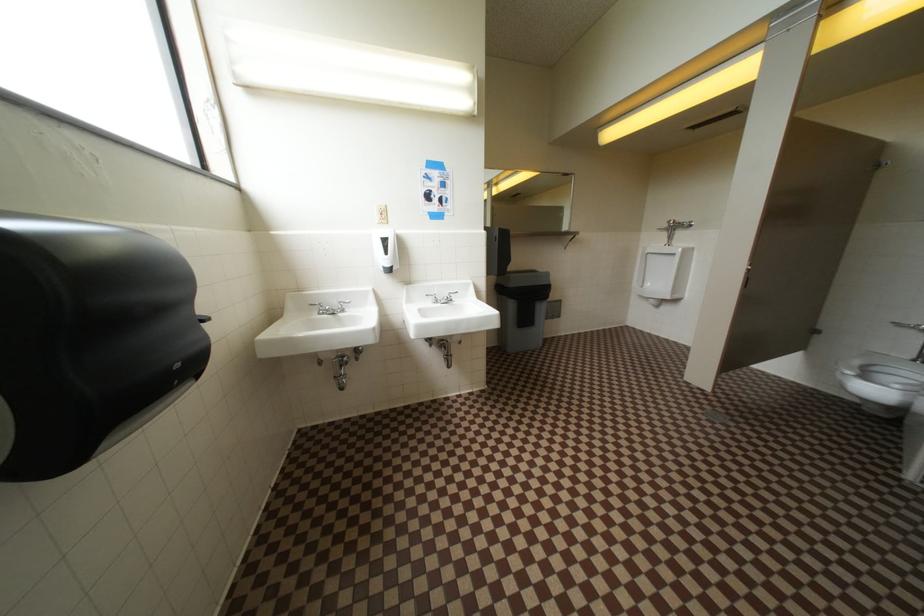
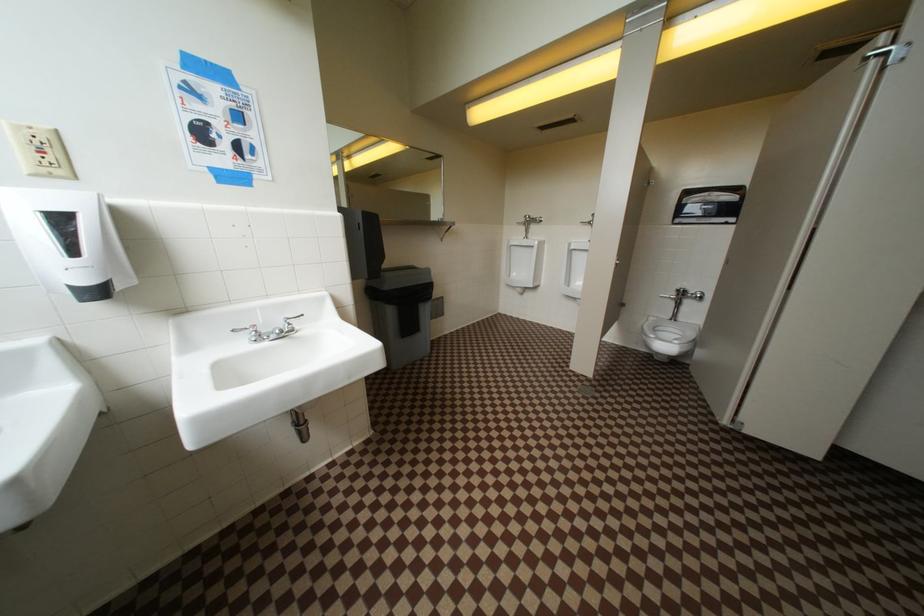
Question: The images are taken continuously from a first-person perspective. In which direction is your viewpoint rotating?

Choices:
 (A) Left
 (B) Right
 (C) Up
 (D) Down

Answer: (B)